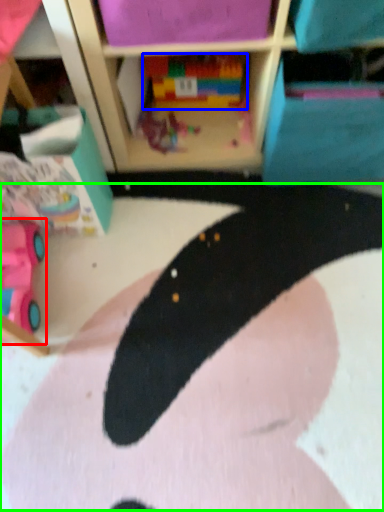
Question: Based on their relative distances, which object is farther from toy (highlighted by a red box)? Choose from toy (highlighted by a blue box) and animal (highlighted by a green box).

Choices:
 (A) toy
 (B) animal

Answer: (A)